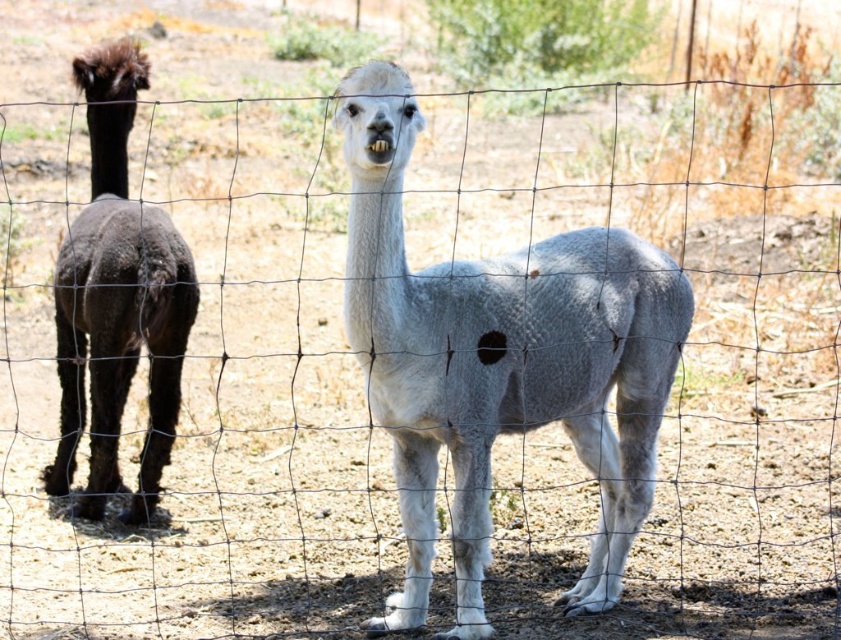
Question: From the image, what is the correct spatial relationship of white woolen alpaca at center in relation to dark brown woolly alpaca at left?

Choices:
 (A) left
 (B) right

Answer: (B)

Question: Among these objects, which one is nearest to the camera?

Choices:
 (A) white woolen alpaca at center
 (B) dark brown woolly alpaca at left

Answer: (A)

Question: Is white woolen alpaca at center closer to the viewer compared to dark brown woolly alpaca at left?

Choices:
 (A) yes
 (B) no

Answer: (A)

Question: Is white woolen alpaca at center positioned before dark brown woolly alpaca at left?

Choices:
 (A) no
 (B) yes

Answer: (B)

Question: Among these points, which one is nearest to the camera?

Choices:
 (A) (660, 362)
 (B) (104, 502)

Answer: (A)